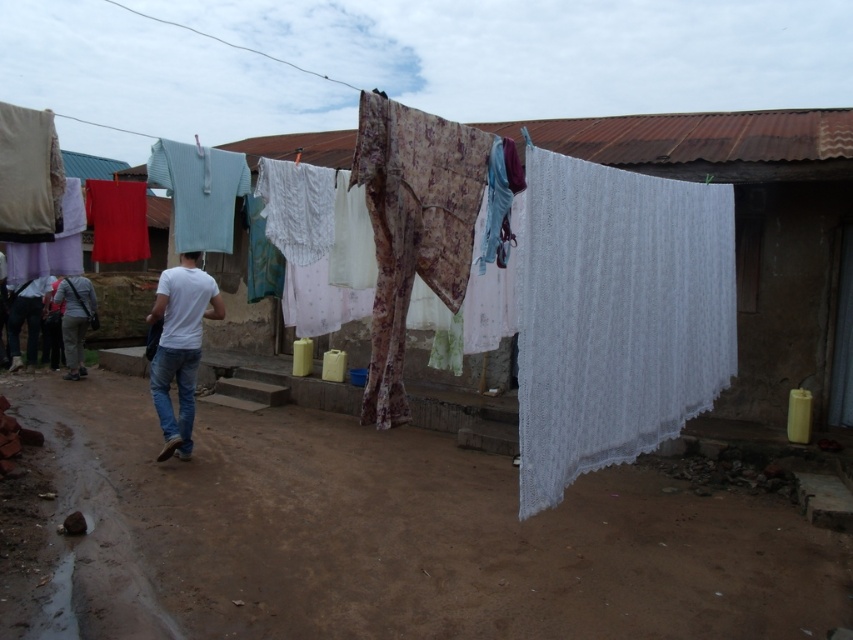
Question: Is the position of white lace cloth at right more distant than that of jeans at center?

Choices:
 (A) yes
 (B) no

Answer: (B)

Question: Based on their relative distances, which object is nearer to the brown dirt track at lower center?

Choices:
 (A) white lace cloth at right
 (B) white lace cloth at center
 (C) jeans at center

Answer: (B)

Question: Is white lace cloth at right positioned at the back of white matte t-shirt at lower left?

Choices:
 (A) no
 (B) yes

Answer: (A)

Question: From the image, what is the correct spatial relationship of brown dirt track at lower center in relation to white lace cloth at center?

Choices:
 (A) above
 (B) below

Answer: (B)

Question: Estimate the real-world distances between objects in this image. Which object is farther from the brown dirt track at lower center?

Choices:
 (A) white lace cloth at right
 (B) jeans at center
 (C) white matte t-shirt at lower left
 (D) white lace cloth at center

Answer: (C)

Question: Which object is positioned closest to the jeans at center?

Choices:
 (A) white lace cloth at right
 (B) white lace cloth at center

Answer: (A)